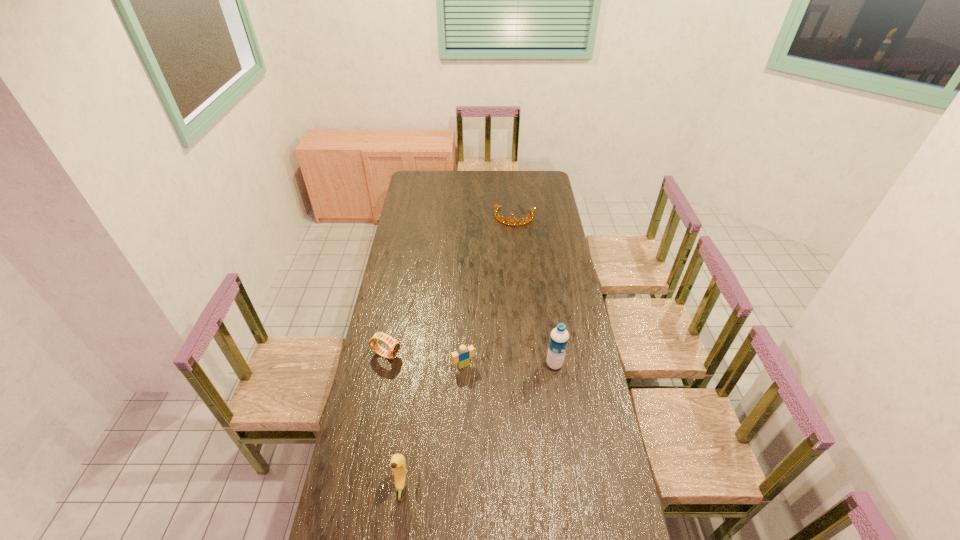
You are a GUI agent. You are given a task and a screenshot of the screen. Output one action in this format:
    pyautogui.click(x=<x>, y=<y>)
    Task: Click on the blank space located on the face of the third object from right to left
    
    Given the screenshot: What is the action you would take?
    pyautogui.click(x=501, y=428)

Image resolution: width=960 pixels, height=540 pixels. I want to click on free space located on the face of the third object from right to left, so click(516, 455).

Identify the location of vacant space located on the face of the third object from right to left. (484, 398).

Locate an element on the screen. free space located 0.300m on the face of the watch is located at coordinates (465, 386).

You are a GUI agent. You are given a task and a screenshot of the screen. Output one action in this format:
    pyautogui.click(x=<x>, y=<y>)
    Task: Click on the vacant space situated on the face of the watch
    
    Given the screenshot: What is the action you would take?
    pyautogui.click(x=461, y=383)

At what (x,y) coordinates should I click in order to perform the action: click on vacant space located 0.270m on the face of the watch. Please return your answer as a coordinate pair (x, y). The height and width of the screenshot is (540, 960). Looking at the image, I should click on (458, 383).

Where is `object that is at the left edge`? The height and width of the screenshot is (540, 960). object that is at the left edge is located at coordinates (393, 345).

Find the location of a particular element. The width and height of the screenshot is (960, 540). water bottle that is at the right edge is located at coordinates (559, 336).

Identify the location of tiara situated at the right edge. Image resolution: width=960 pixels, height=540 pixels. (496, 207).

Locate an element on the screen. The image size is (960, 540). vacant point at the near edge is located at coordinates (399, 508).